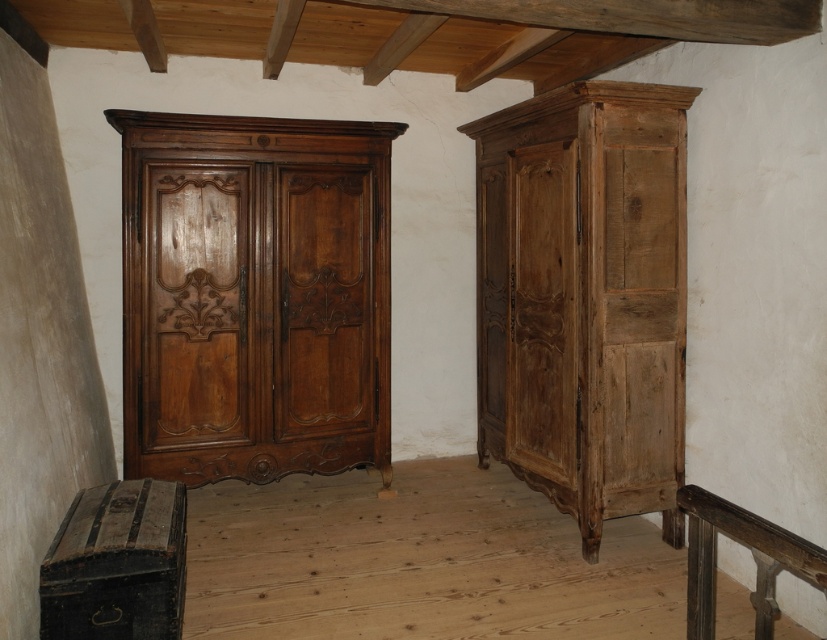
Question: Estimate the real-world distances between objects in this image. Which object is closer to the rustic wood balustrade at lower right?

Choices:
 (A) natural wood dresser at right
 (B) polished brown wood dresser at left

Answer: (A)

Question: Which object is positioned farthest from the rustic wood balustrade at lower right?

Choices:
 (A) natural wood dresser at right
 (B) polished brown wood dresser at left

Answer: (B)

Question: Estimate the real-world distances between objects in this image. Which object is closer to the polished brown wood dresser at left?

Choices:
 (A) rustic wood balustrade at lower right
 (B) natural wood dresser at right

Answer: (B)

Question: Is polished brown wood dresser at left below rustic wood balustrade at lower right?

Choices:
 (A) yes
 (B) no

Answer: (B)

Question: Can you confirm if natural wood dresser at right is thinner than rustic wood balustrade at lower right?

Choices:
 (A) yes
 (B) no

Answer: (B)

Question: Does polished brown wood dresser at left appear on the left side of rustic wood balustrade at lower right?

Choices:
 (A) yes
 (B) no

Answer: (A)